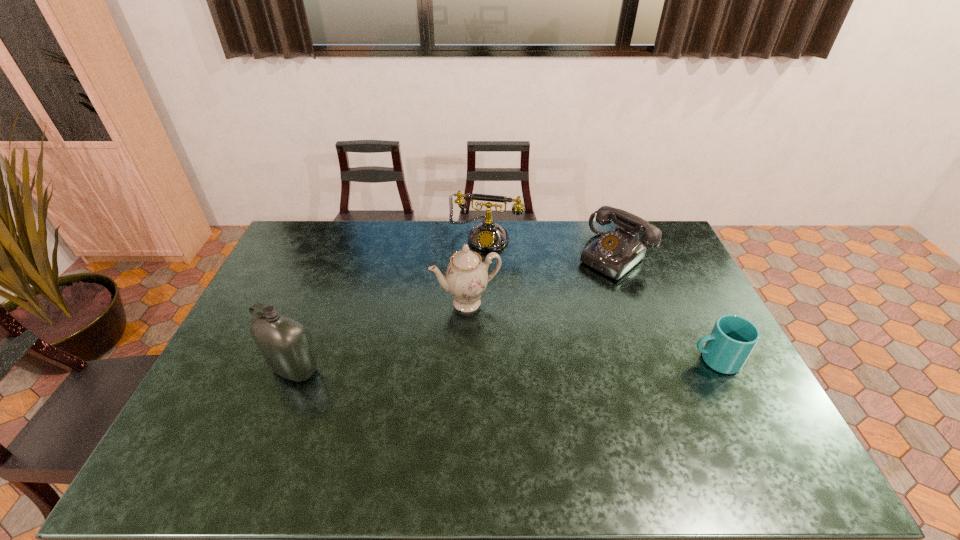
Find the location of a particular element. The height and width of the screenshot is (540, 960). object that is at the left edge is located at coordinates (284, 342).

Image resolution: width=960 pixels, height=540 pixels. I want to click on cup that is at the right edge, so click(732, 339).

Identify the location of telephone located in the right edge section of the desktop. The width and height of the screenshot is (960, 540). (614, 253).

Where is `object present at the far right corner`? Image resolution: width=960 pixels, height=540 pixels. object present at the far right corner is located at coordinates (614, 253).

The width and height of the screenshot is (960, 540). Identify the location of vacant area at the far edge of the desktop. (539, 254).

In the image, there is a desktop. Where is `vacant space at the near edge`? This screenshot has height=540, width=960. vacant space at the near edge is located at coordinates (658, 420).

Find the location of `vacant area at the left edge of the desktop`. vacant area at the left edge of the desktop is located at coordinates (289, 309).

You are a GUI agent. You are given a task and a screenshot of the screen. Output one action in this format:
    pyautogui.click(x=<x>, y=<y>)
    Task: Click on the free space at the far right corner of the desktop
    The height and width of the screenshot is (540, 960).
    Given the screenshot: What is the action you would take?
    pyautogui.click(x=655, y=222)

This screenshot has height=540, width=960. What are the coordinates of `vacant region between the cup and the chinaware` in the screenshot? It's located at (590, 332).

Locate an element on the screen. This screenshot has width=960, height=540. unoccupied position between the shortest object and the taller telephone is located at coordinates (600, 298).